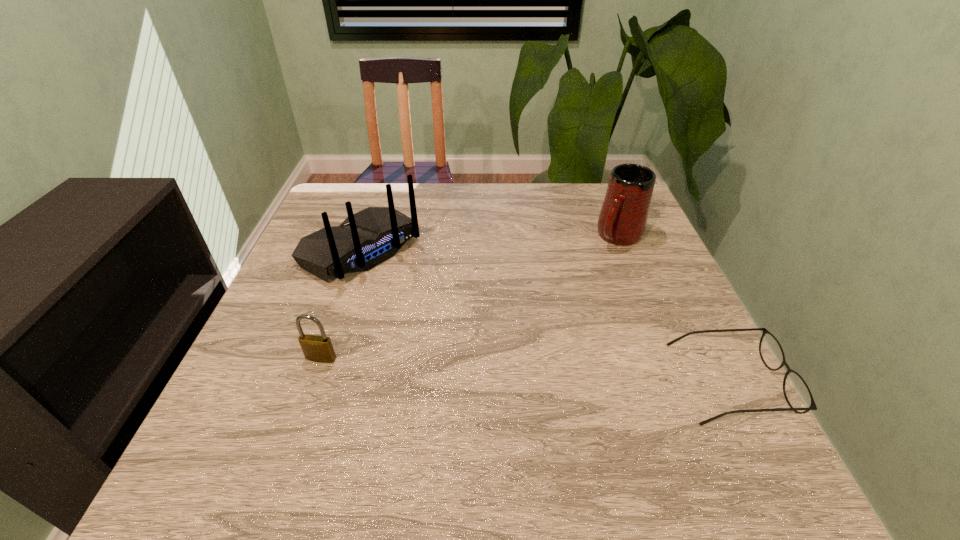
This screenshot has width=960, height=540. What are the coordinates of `padlock` in the screenshot? It's located at (315, 348).

Where is `spectacles`? The height and width of the screenshot is (540, 960). spectacles is located at coordinates (797, 393).

Locate an element on the screen. router is located at coordinates (363, 240).

Where is `mug`? This screenshot has width=960, height=540. mug is located at coordinates (622, 221).

I want to click on free spot located on the back of the padlock, so click(x=356, y=254).

Image resolution: width=960 pixels, height=540 pixels. In order to click on free space located on the back of the router in this screenshot , I will do (486, 342).

Find the location of a particular element. Image resolution: width=960 pixels, height=540 pixels. blank space located on the back of the router is located at coordinates [x=492, y=347].

This screenshot has width=960, height=540. In order to click on vacant space located 0.310m on the back of the router in this screenshot , I will do `click(492, 347)`.

Image resolution: width=960 pixels, height=540 pixels. Identify the location of blank space located on the side of the mug with the handle. (587, 273).

You are a GUI agent. You are given a task and a screenshot of the screen. Output one action in this format:
    pyautogui.click(x=<x>, y=<y>)
    Task: Click on the free location located on the side of the mug with the handle
    The width and height of the screenshot is (960, 540).
    Given the screenshot: What is the action you would take?
    pyautogui.click(x=552, y=310)